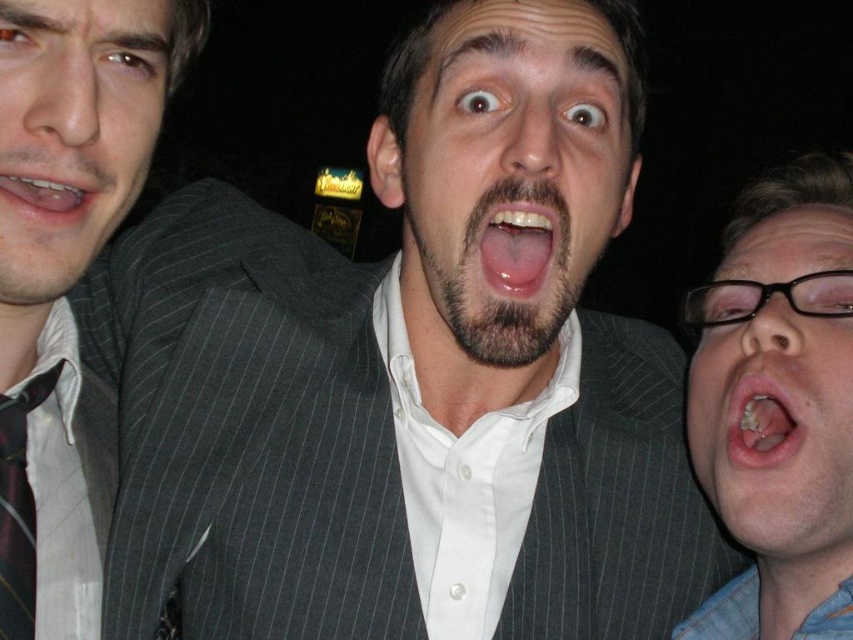
Who is shorter, pinstriped suit at center or maroon striped tie at left?

With less height is maroon striped tie at left.

Does point (9, 166) come in front of point (7, 545)?

Yes, it is in front of point (7, 545).

Locate an element on the screen. The height and width of the screenshot is (640, 853). pinstriped suit at center is located at coordinates (67, 276).

This screenshot has width=853, height=640. I want to click on pinstriped suit at center, so click(67, 276).

Is matte gray suit at center shorter than maroon striped tie at left?

Incorrect, matte gray suit at center's height does not fall short of maroon striped tie at left's.

Can you confirm if matte gray suit at center is bigger than maroon striped tie at left?

Yes.

Does point (534, 67) lie behind point (49, 388)?

That is True.

At what (x,y) coordinates should I click in order to perform the action: click on matte gray suit at center. Please return your answer as a coordinate pair (x, y). Looking at the image, I should click on (514, 170).

Can you confirm if matte gray suit at center is wider than matte black teeth at center?

Indeed, matte gray suit at center has a greater width compared to matte black teeth at center.

Is point (483, 74) positioned behind point (19, 182)?

That is True.

At what (x,y) coordinates should I click in order to perform the action: click on matte gray suit at center. Please return your answer as a coordinate pair (x, y). The width and height of the screenshot is (853, 640). Looking at the image, I should click on (514, 170).